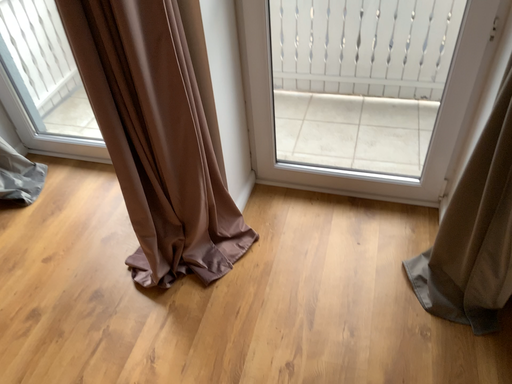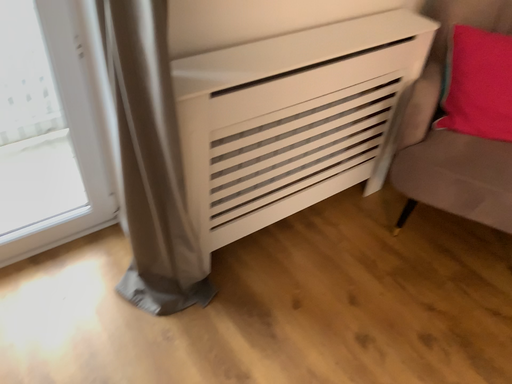
Question: How did the camera likely rotate when shooting the video?

Choices:
 (A) rotated left
 (B) rotated right

Answer: (B)